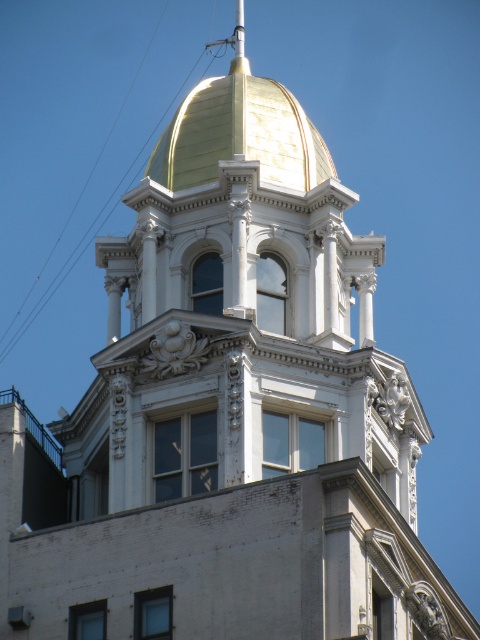
Is gold polished dome at upper center thinner than transparent wire at upper left?

Correct, gold polished dome at upper center's width is less than transparent wire at upper left's.

Who is positioned more to the right, gold polished dome at upper center or transparent wire at upper left?

gold polished dome at upper center

Is point (173, 131) closer to camera compared to point (60, 269)?

Yes, point (173, 131) is in front of point (60, 269).

I want to click on gold polished dome at upper center, so click(x=240, y=134).